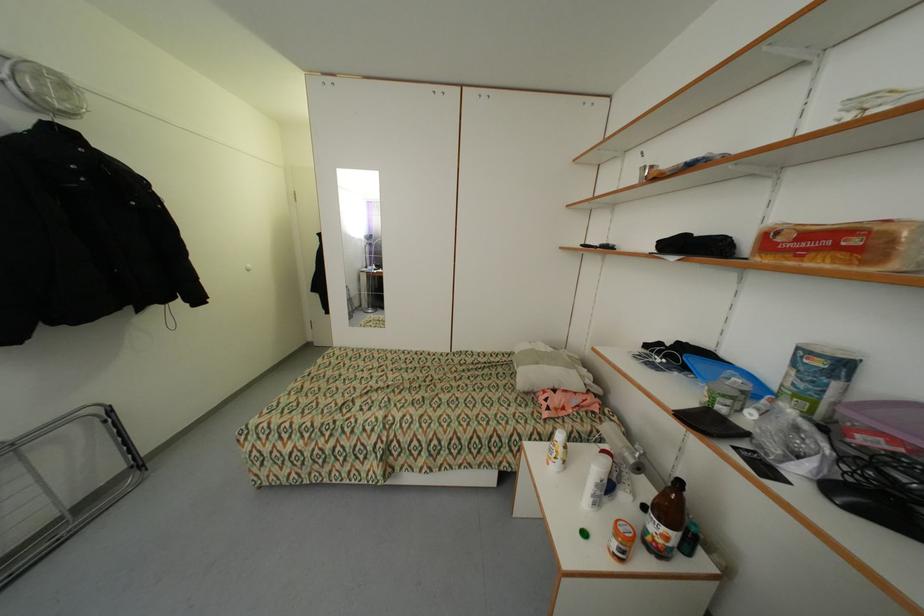
Where is `green bottle cap`? green bottle cap is located at coordinates tap(584, 533).